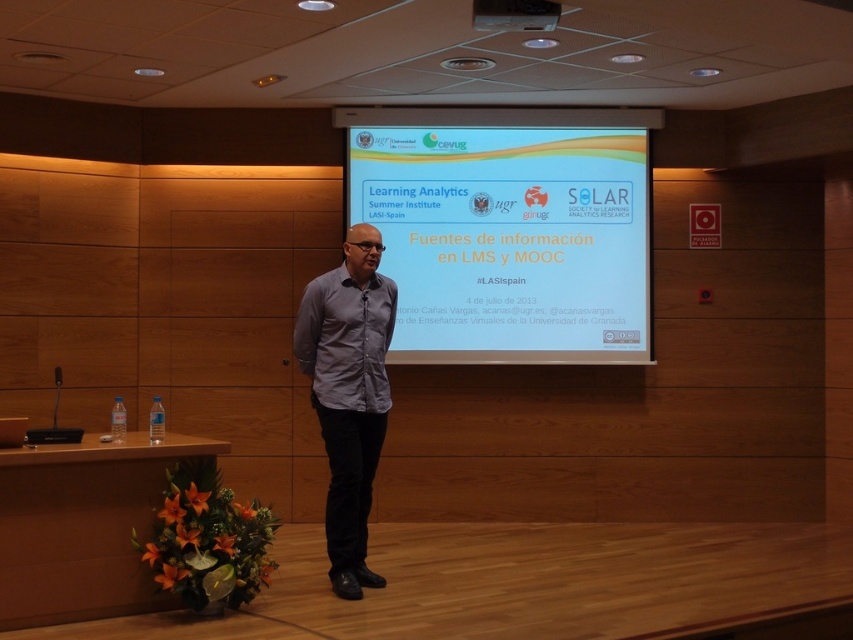
Question: Which object is farther from the camera taking this photo?

Choices:
 (A) matte black projector at upper center
 (B) gray matte shirt at center

Answer: (B)

Question: Where is gray matte shirt at center located in relation to matte black projector at upper center in the image?

Choices:
 (A) right
 (B) left

Answer: (B)

Question: Can you confirm if white glossy projector screen at center is thinner than gray matte shirt at center?

Choices:
 (A) no
 (B) yes

Answer: (A)

Question: Which object appears farthest from the camera in this image?

Choices:
 (A) matte black projector at upper center
 (B) white glossy projector screen at center
 (C) gray matte shirt at center

Answer: (B)

Question: Is the position of white glossy projector screen at center more distant than that of matte black projector at upper center?

Choices:
 (A) no
 (B) yes

Answer: (B)

Question: Which of these objects is positioned closest to the matte black projector at upper center?

Choices:
 (A) gray matte shirt at center
 (B) white glossy projector screen at center

Answer: (A)